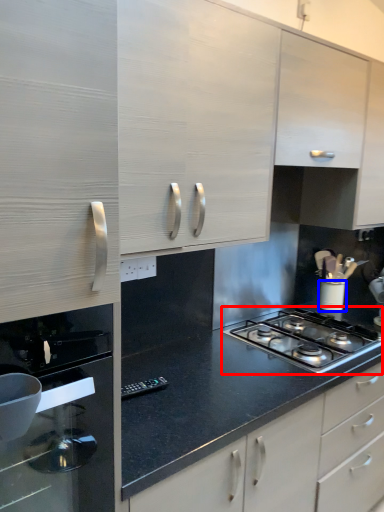
Question: Which object is closer to the camera taking this photo, gas stove (highlighted by a red box) or kitchen appliance (highlighted by a blue box)?

Choices:
 (A) gas stove
 (B) kitchen appliance

Answer: (A)